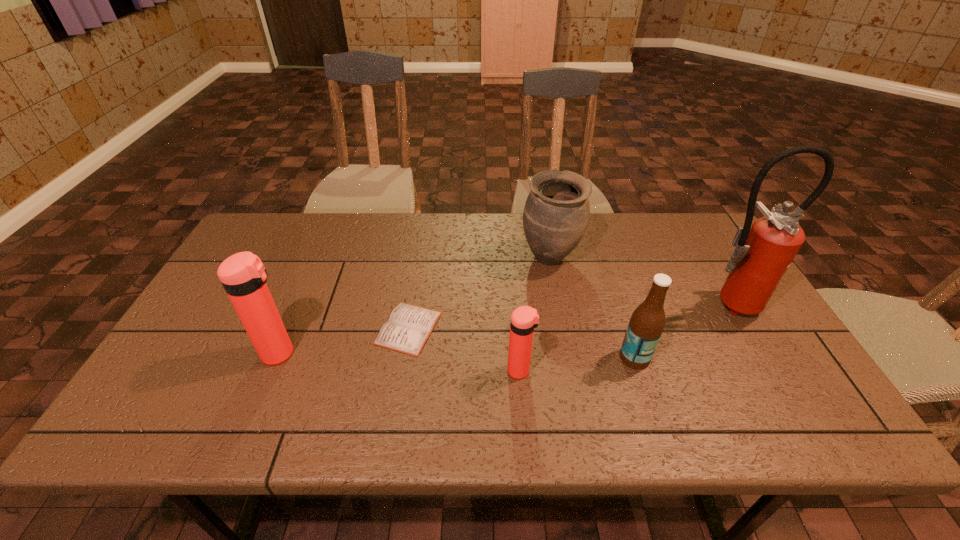
You are a GUI agent. You are given a task and a screenshot of the screen. Output one action in this format:
    pyautogui.click(x=<x>, y=<y>)
    Task: Click on the vacant space at the near edge of the desktop
    The width and height of the screenshot is (960, 540).
    Given the screenshot: What is the action you would take?
    pyautogui.click(x=396, y=386)

Identify the location of free spot at the right edge of the desktop. This screenshot has width=960, height=540. (715, 290).

This screenshot has width=960, height=540. What are the coordinates of `free space at the far left corner` in the screenshot? It's located at (275, 223).

At what (x,y) coordinates should I click in order to perform the action: click on vacant space at the far right corner. Please return your answer as a coordinate pair (x, y). This screenshot has width=960, height=540. Looking at the image, I should click on (663, 218).

Identify the location of vacant space in between the left thermos bottle and the shorter thermos bottle. The height and width of the screenshot is (540, 960). (400, 362).

Where is `free space between the beer bottle and the left thermos bottle`? The width and height of the screenshot is (960, 540). free space between the beer bottle and the left thermos bottle is located at coordinates (457, 356).

Locate an element on the screen. The width and height of the screenshot is (960, 540). vacant area that lies between the left thermos bottle and the rightmost object is located at coordinates (503, 329).

You are a GUI agent. You are given a task and a screenshot of the screen. Output one action in this format:
    pyautogui.click(x=<x>, y=<y>)
    Task: Click on the free point between the left thermos bottle and the fifth tallest object
    The image size is (960, 540).
    Given the screenshot: What is the action you would take?
    pyautogui.click(x=400, y=362)

This screenshot has height=540, width=960. I want to click on free space between the beer bottle and the urn, so click(x=592, y=308).

Locate an element on the screen. vacant region between the tallest object and the urn is located at coordinates (638, 281).